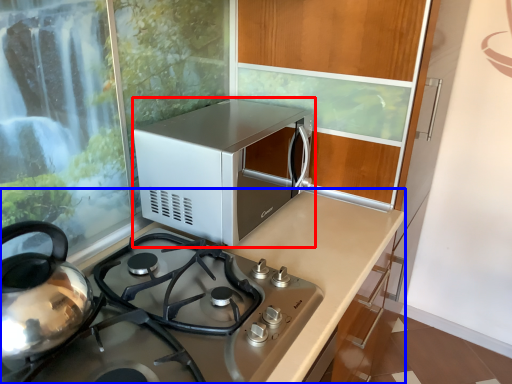
Question: Which point is further to the camera, microwave oven (highlighted by a red box) or countertop (highlighted by a blue box)?

Choices:
 (A) microwave oven
 (B) countertop

Answer: (A)